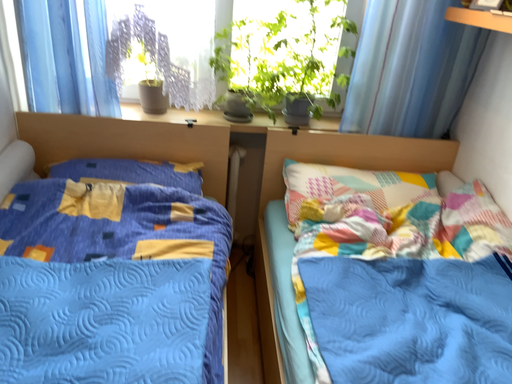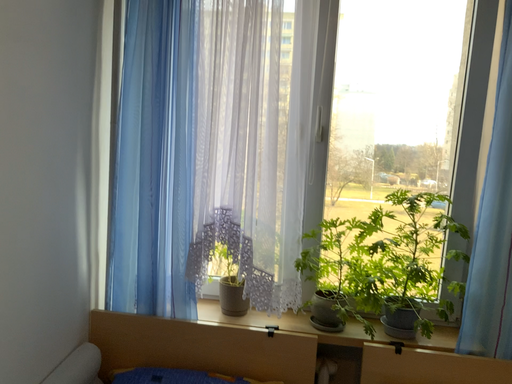
Question: Which way did the camera rotate in the video?

Choices:
 (A) rotated right
 (B) rotated left

Answer: (B)